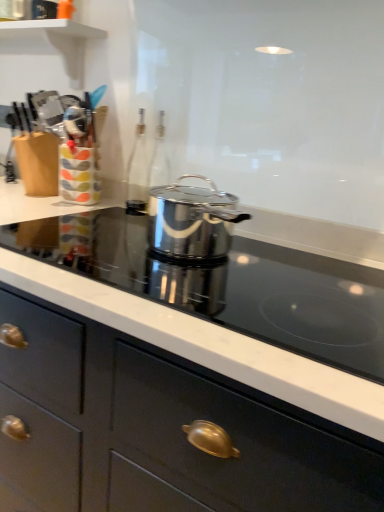
Locate an element on the screen. Image resolution: width=384 pixels, height=512 pixels. empty space that is ontop of polished stainless steel pot at center (from a real-world perspective) is located at coordinates (146, 251).